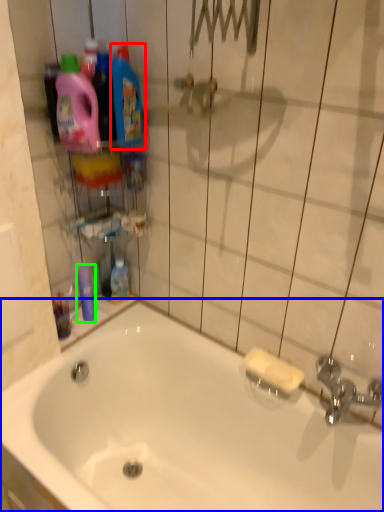
Question: Considering the real-world distances, which object is farthest from cleaning product (highlighted by a red box)? bathtub (highlighted by a blue box) or mouthwash (highlighted by a green box)?

Choices:
 (A) bathtub
 (B) mouthwash

Answer: (A)